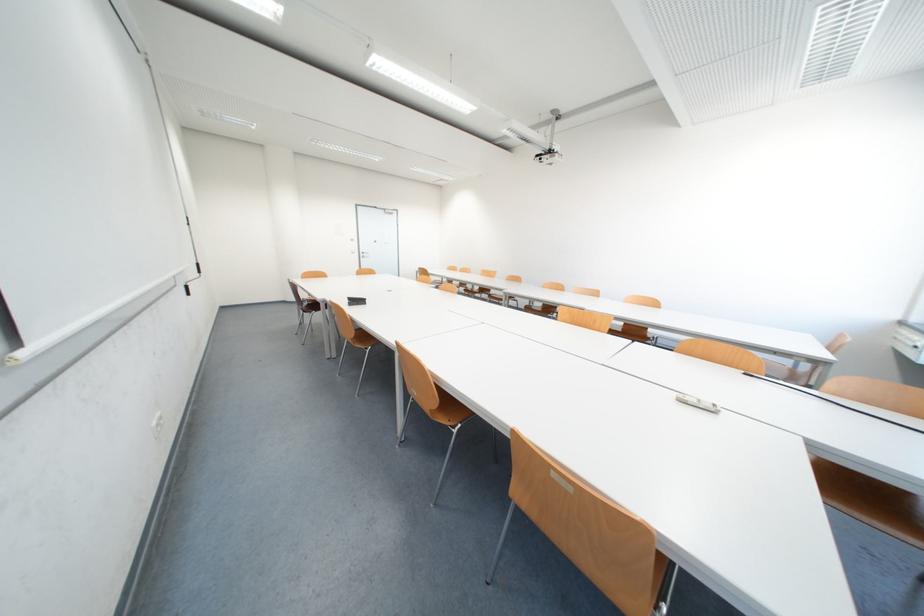
Locate an element on the screen. door handle is located at coordinates (363, 257).